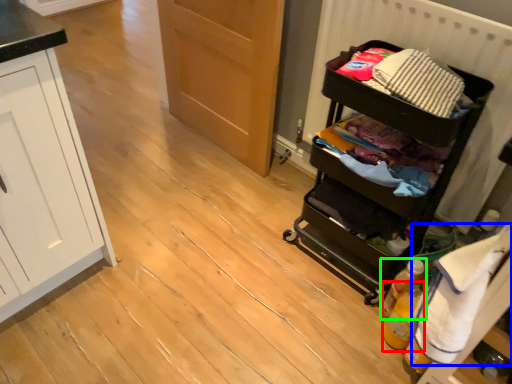
Question: Which object is the farthest from bottle (highlighted by a red box)? Choose among these: clothing (highlighted by a blue box) or bottle (highlighted by a green box).

Choices:
 (A) clothing
 (B) bottle

Answer: (A)